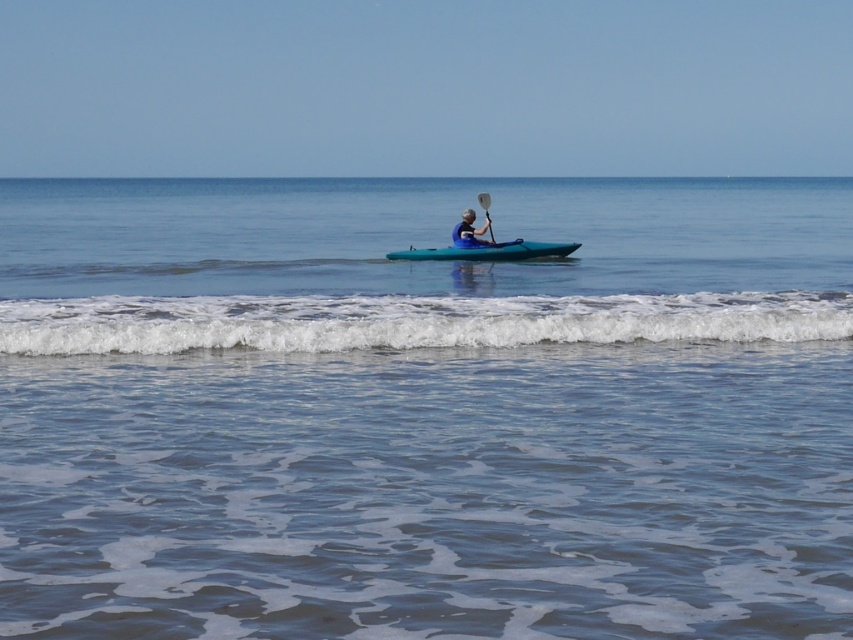
Question: Based on their relative distances, which object is farther from the matte blue kayak at center?

Choices:
 (A) teal glossy canoe at center
 (B) white foamy wave at lower center
 (C) white plastic paddle at center

Answer: (B)

Question: Which object is closer to the camera taking this photo?

Choices:
 (A) clear blue water at center
 (B) teal glossy canoe at center
 (C) white foamy wave at lower center

Answer: (A)

Question: Can you confirm if clear blue water at center is smaller than white foamy wave at lower center?

Choices:
 (A) yes
 (B) no

Answer: (B)

Question: Can you confirm if clear blue water at center is positioned to the right of white plastic paddle at center?

Choices:
 (A) yes
 (B) no

Answer: (A)

Question: Can you confirm if teal glossy canoe at center is bigger than white plastic paddle at center?

Choices:
 (A) yes
 (B) no

Answer: (A)

Question: Which object appears closest to the camera in this image?

Choices:
 (A) white plastic paddle at center
 (B) teal glossy canoe at center
 (C) clear blue water at center

Answer: (C)